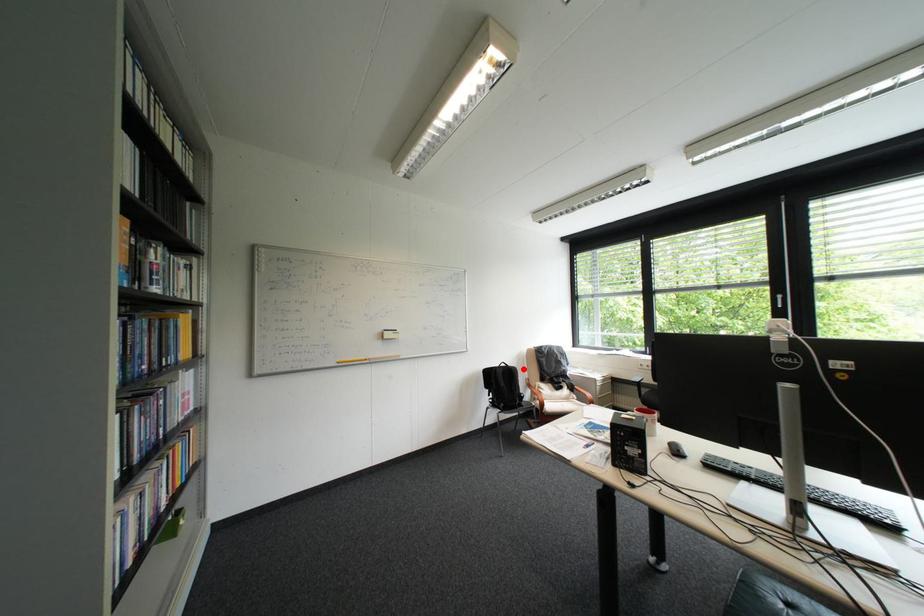
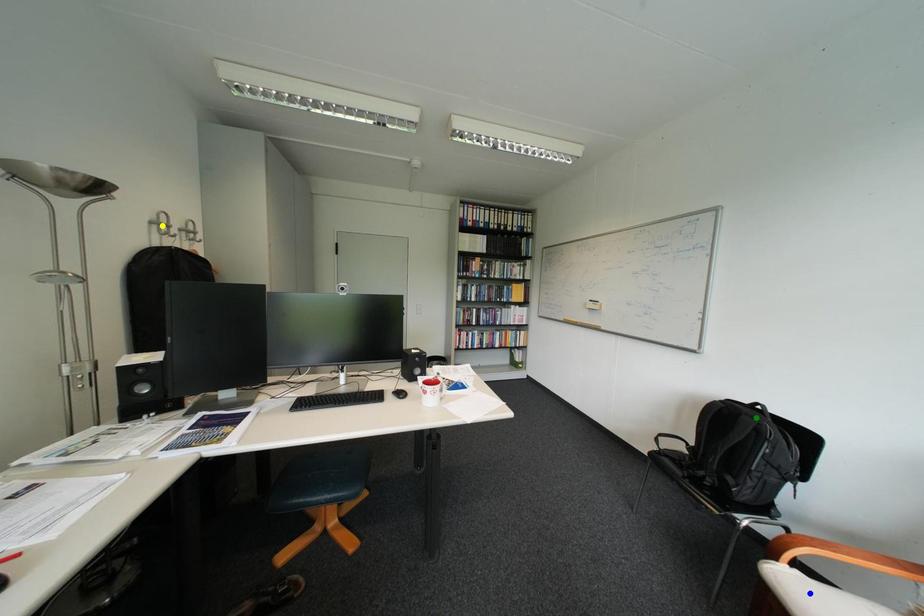
Question: I am providing you with two images of the same scene from different viewpoints. A red point is marked on the first image. You are given multiple points on the second image. Which point in image 2 represents the same 3d spot as the red point in image 1?

Choices:
 (A) yellow point
 (B) blue point
 (C) green point

Answer: (C)